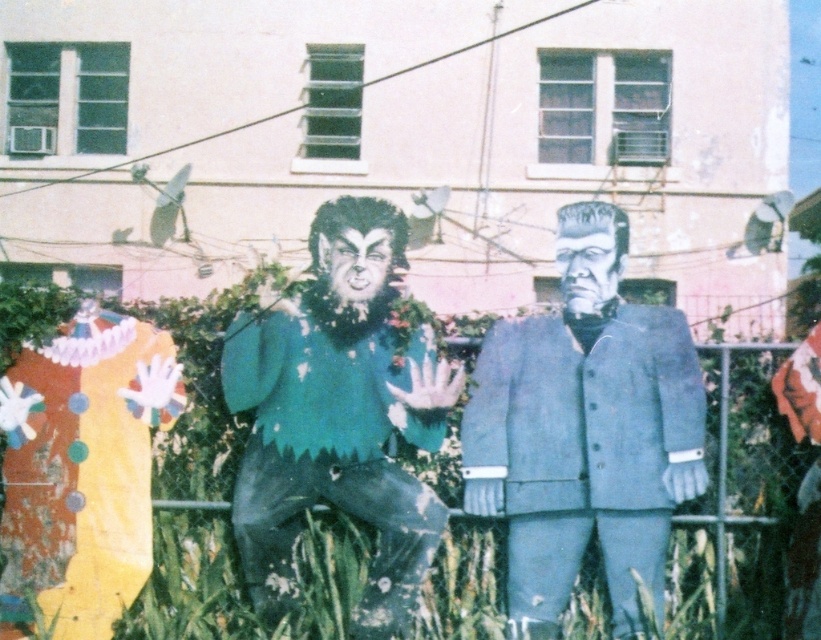
You are a costume designer preparing for a Halloween event. You have two suits to display side by side. The matte blue suit at center and the green matte suit at center. Which one has a bigger size?

The matte blue suit at center is larger in size than the green matte suit at center.